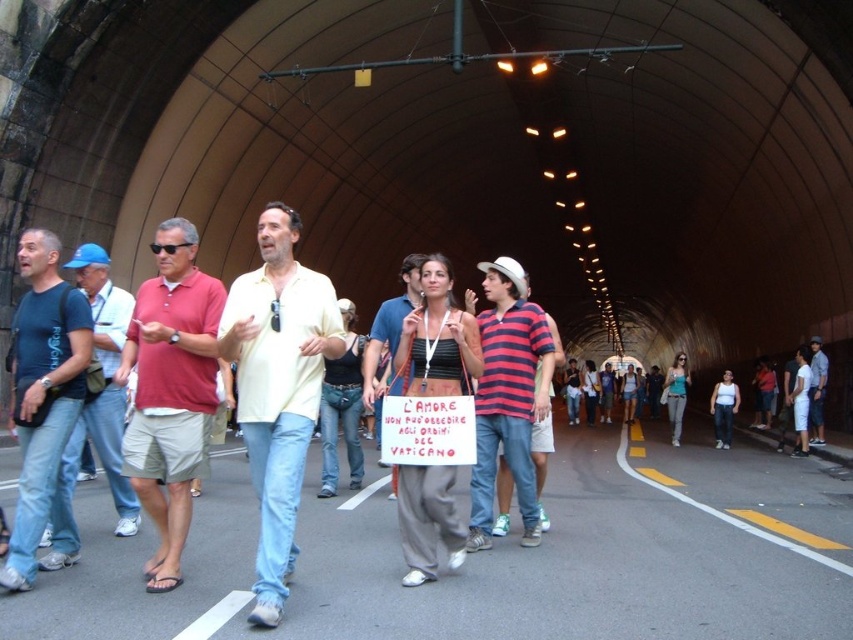
You are a photographer trying to capture a photo of the two people wearing yellow shirts in the tunnel. The light yellow shirt at center and the matte yellow shirt at center are both in the frame. Which one is on the left side when looking towards the tunnel exit?

The light yellow shirt at center is positioned on the left side of matte yellow shirt at center, so the light yellow shirt at center is on the left when looking towards the tunnel exit.